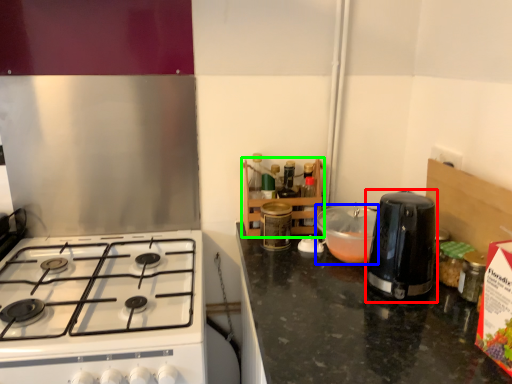
Question: Which object is positioned farthest from kitchen appliance (highlighted by a red box)? Select from kitchen appliance (highlighted by a blue box) and shelf (highlighted by a green box).

Choices:
 (A) kitchen appliance
 (B) shelf

Answer: (B)